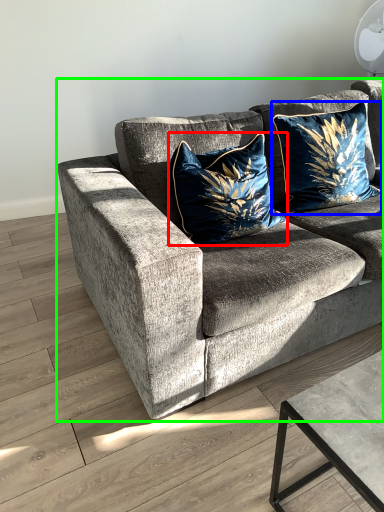
Question: Which is farther away from pillow (highlighted by a red box)? pillow (highlighted by a blue box) or studio couch (highlighted by a green box)?

Choices:
 (A) pillow
 (B) studio couch

Answer: (A)